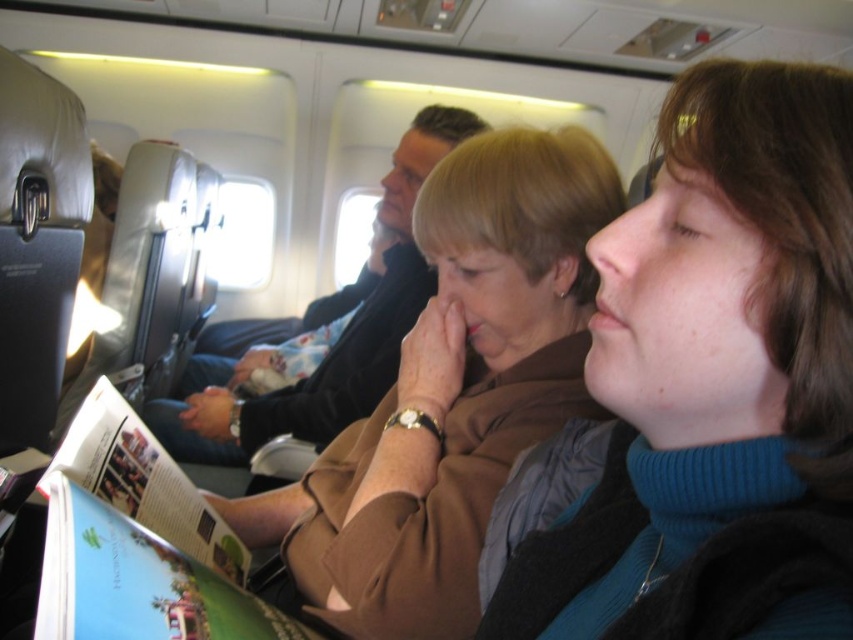
Between blue fleece at center and matte paper magazine at center, which one is positioned higher?

blue fleece at center is above.

Is point (732, 522) closer to viewer compared to point (142, 484)?

Yes, point (732, 522) is closer to viewer.

Image resolution: width=853 pixels, height=640 pixels. Identify the location of blue fleece at center. 717,384.

Can you confirm if brown fabric jacket at center is positioned above matte paper magazine at center?

Yes.

Can you confirm if brown fabric jacket at center is positioned below matte paper magazine at center?

No.

The width and height of the screenshot is (853, 640). Describe the element at coordinates (451, 392) in the screenshot. I see `brown fabric jacket at center` at that location.

The height and width of the screenshot is (640, 853). What are the coordinates of `brown fabric jacket at center` in the screenshot? It's located at (451, 392).

Is point (834, 356) farther from camera compared to point (480, 492)?

No.

Can you confirm if blue fleece at center is smaller than brown fabric jacket at center?

Indeed, blue fleece at center has a smaller size compared to brown fabric jacket at center.

Which is in front, point (682, 586) or point (430, 326)?

Point (682, 586) is in front.

Identify the location of blue fleece at center. (717, 384).